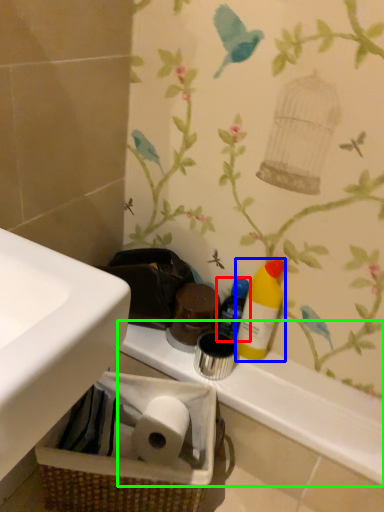
Question: Which object is the closest to the bottle (highlighted by a red box)? Choose among these: cleaning product (highlighted by a blue box) or counter top (highlighted by a green box).

Choices:
 (A) cleaning product
 (B) counter top

Answer: (A)